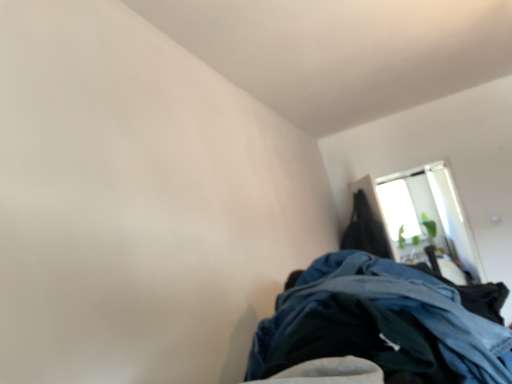
Question: From the image's perspective, does black matte coat at upper right appear higher than transparent glass window at upper right?

Choices:
 (A) yes
 (B) no

Answer: (A)

Question: Is black matte coat at upper right not inside transparent glass window at upper right?

Choices:
 (A) yes
 (B) no

Answer: (A)

Question: Does black matte coat at upper right have a lesser height compared to transparent glass window at upper right?

Choices:
 (A) yes
 (B) no

Answer: (A)

Question: Considering the relative sizes of black matte coat at upper right and transparent glass window at upper right in the image provided, is black matte coat at upper right smaller than transparent glass window at upper right?

Choices:
 (A) no
 (B) yes

Answer: (B)

Question: Is transparent glass window at upper right a part of black matte coat at upper right?

Choices:
 (A) yes
 (B) no

Answer: (B)

Question: Does black matte coat at upper right have a lesser width compared to transparent glass window at upper right?

Choices:
 (A) no
 (B) yes

Answer: (A)

Question: Is transparent glass window at upper right at the right side of black matte coat at upper right?

Choices:
 (A) no
 (B) yes

Answer: (B)

Question: Considering the relative positions of transparent glass window at upper right and black matte coat at upper right in the image provided, is transparent glass window at upper right to the left of black matte coat at upper right from the viewer's perspective?

Choices:
 (A) yes
 (B) no

Answer: (B)

Question: Is transparent glass window at upper right outside of black matte coat at upper right?

Choices:
 (A) yes
 (B) no

Answer: (A)

Question: From the image's perspective, is transparent glass window at upper right above black matte coat at upper right?

Choices:
 (A) no
 (B) yes

Answer: (A)

Question: Can you confirm if transparent glass window at upper right is bigger than black matte coat at upper right?

Choices:
 (A) yes
 (B) no

Answer: (A)

Question: Can you confirm if transparent glass window at upper right is taller than black matte coat at upper right?

Choices:
 (A) no
 (B) yes

Answer: (B)

Question: In terms of size, does black matte coat at upper right appear bigger or smaller than transparent glass window at upper right?

Choices:
 (A) big
 (B) small

Answer: (B)